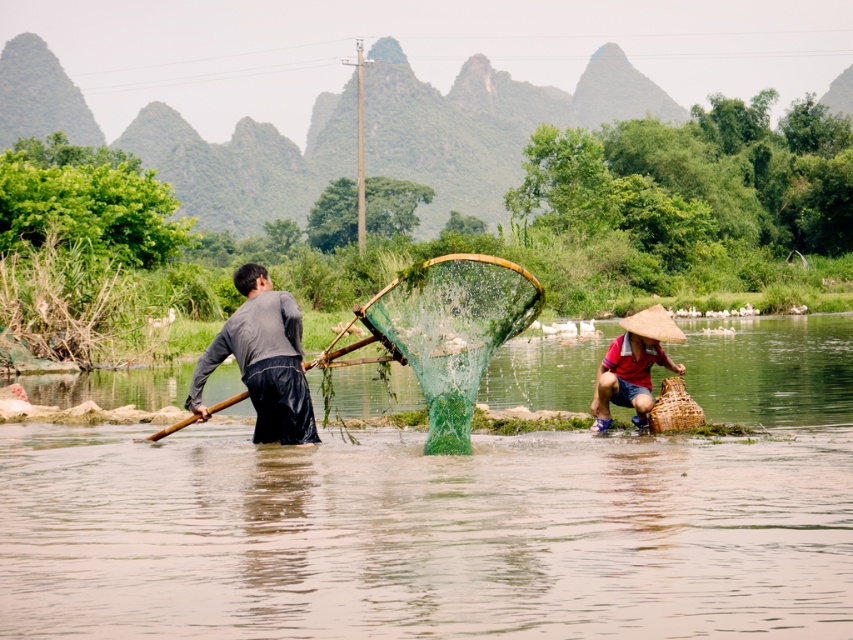
You are a tourist visiting this scenic area and want to take a photo of both the green mesh fishing net at center and the dark gray fabric shirt at center in the same frame. Given that your camera has a maximum focal length that allows capturing objects up to 5 meters apart in the same shot, will you be able to include both in your photo?

The green mesh fishing net at center and the dark gray fabric shirt at center are 4.06 meters apart. Since 4.06 meters is less than the camera maximum focal length of 5 meters, you can capture both in the same frame.